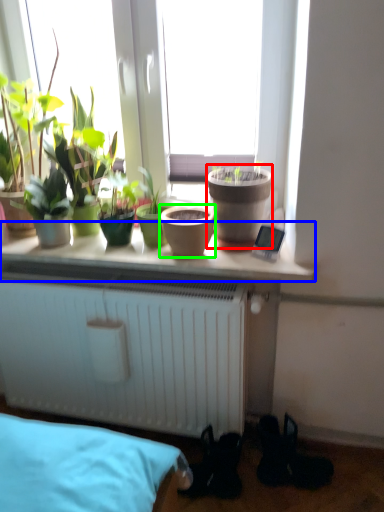
Question: Based on their relative distances, which object is farther from flowerpot (highlighted by a red box)? Choose from window sill (highlighted by a blue box) and flowerpot (highlighted by a green box).

Choices:
 (A) window sill
 (B) flowerpot

Answer: (A)